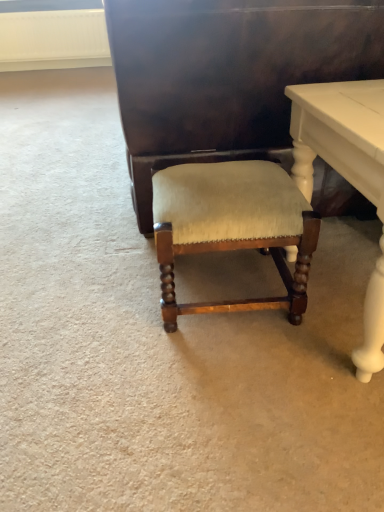
Identify the location of vacant space situated above suede-like beige cushion at center (from a real-world perspective). This screenshot has width=384, height=512. (216, 182).